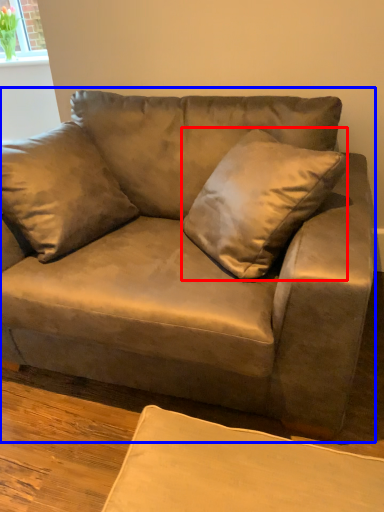
Question: Among these objects, which one is farthest to the camera, throw pillow (highlighted by a red box) or studio couch (highlighted by a blue box)?

Choices:
 (A) throw pillow
 (B) studio couch

Answer: (A)